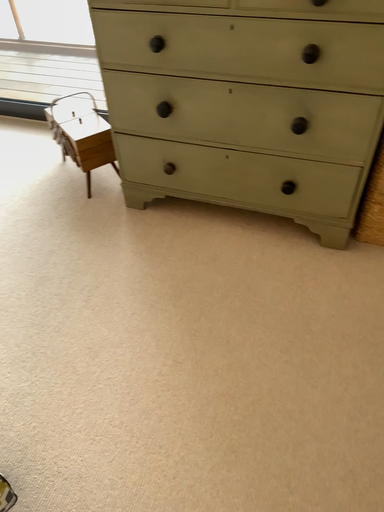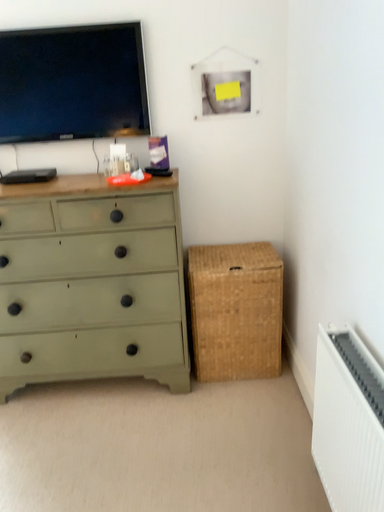
Question: Which way did the camera rotate in the video?

Choices:
 (A) rotated left
 (B) rotated right

Answer: (B)